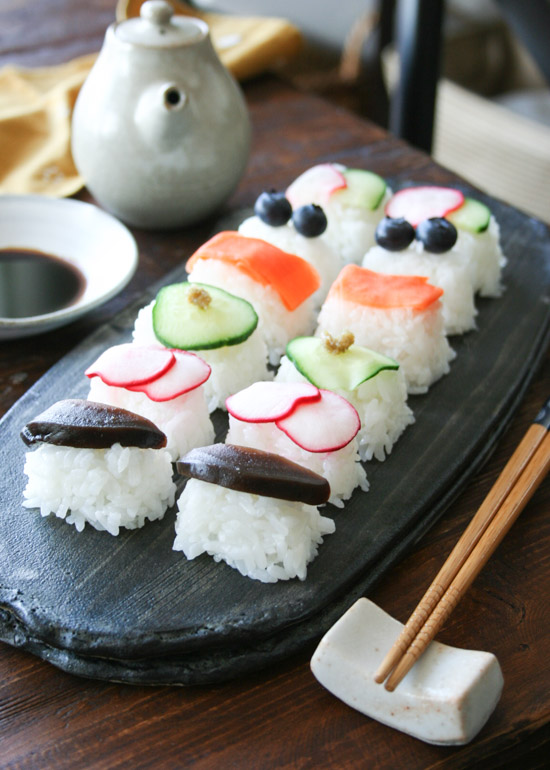
At what (x,y) coordinates should I click in order to perform the action: click on plate of sushi. Please return your answer as a coordinate pair (x, y). The width and height of the screenshot is (550, 770). Looking at the image, I should click on (151, 573).